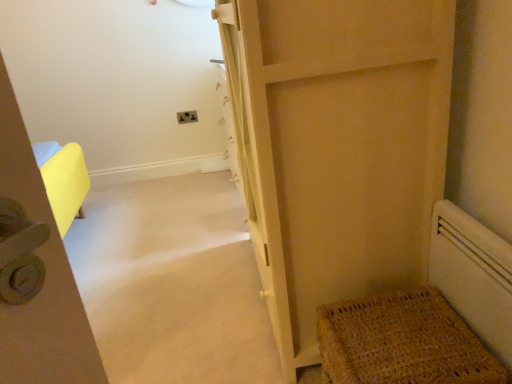
Question: Considering the positions of matte plastic electric outlet at center and woven brown mat at lower right in the image, is matte plastic electric outlet at center bigger or smaller than woven brown mat at lower right?

Choices:
 (A) big
 (B) small

Answer: (B)

Question: From the image's perspective, is matte plastic electric outlet at center above or below woven brown mat at lower right?

Choices:
 (A) below
 (B) above

Answer: (B)

Question: Estimate the real-world distances between objects in this image. Which object is closer to the matte plastic electric outlet at center?

Choices:
 (A) woven brown mat at lower right
 (B) matte wood door at center
 (C) white matte radiator at lower right

Answer: (B)

Question: Which object is the farthest from the matte wood door at center?

Choices:
 (A) white matte radiator at lower right
 (B) matte plastic electric outlet at center
 (C) woven brown mat at lower right

Answer: (B)